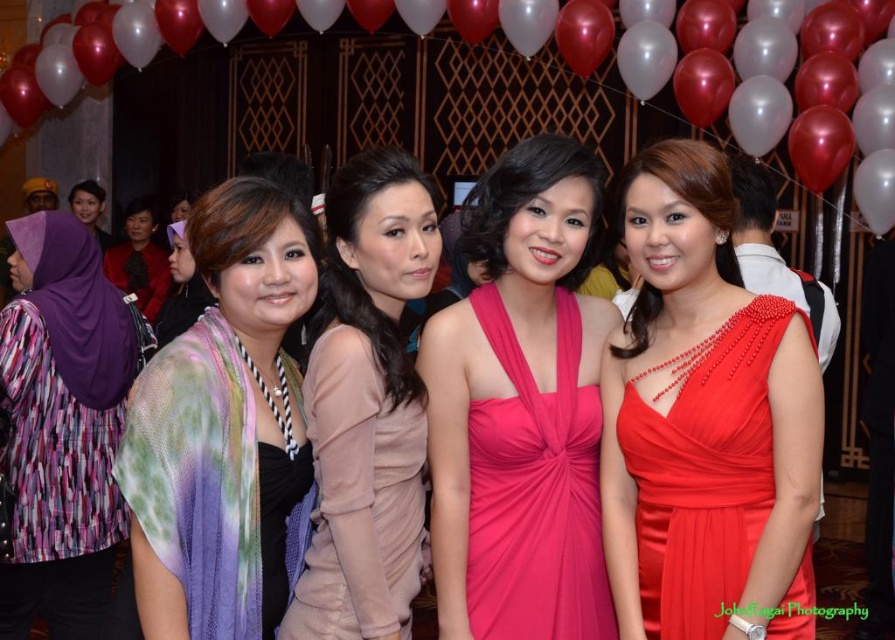
Image resolution: width=895 pixels, height=640 pixels. What do you see at coordinates (226, 428) in the screenshot? I see `pastel tie-dye scarf at center` at bounding box center [226, 428].

Who is shorter, pastel tie-dye scarf at center or shiny red dress at right?

pastel tie-dye scarf at center

Locate an element on the screen. This screenshot has height=640, width=895. pastel tie-dye scarf at center is located at coordinates (226, 428).

Is matte black dress at center to the right of matte black hijab at upper left from the viewer's perspective?

Indeed, matte black dress at center is positioned on the right side of matte black hijab at upper left.

From the picture: Which is above, matte black dress at center or matte black hijab at upper left?

Positioned higher is matte black hijab at upper left.

Is point (182, 289) closer to viewer compared to point (79, 200)?

Yes, point (182, 289) is closer to viewer.

What are the coordinates of `matte black dress at center` in the screenshot? It's located at (180, 289).

Does matte beige dress at center lie in front of matte black dress at left?

Yes, it is.

Between matte beige dress at center and matte black dress at left, which one has less height?

With less height is matte beige dress at center.

Does point (352, 500) come behind point (139, 294)?

No, it is in front of (139, 294).

Where is `matte beige dress at center`? matte beige dress at center is located at coordinates pyautogui.click(x=367, y=404).